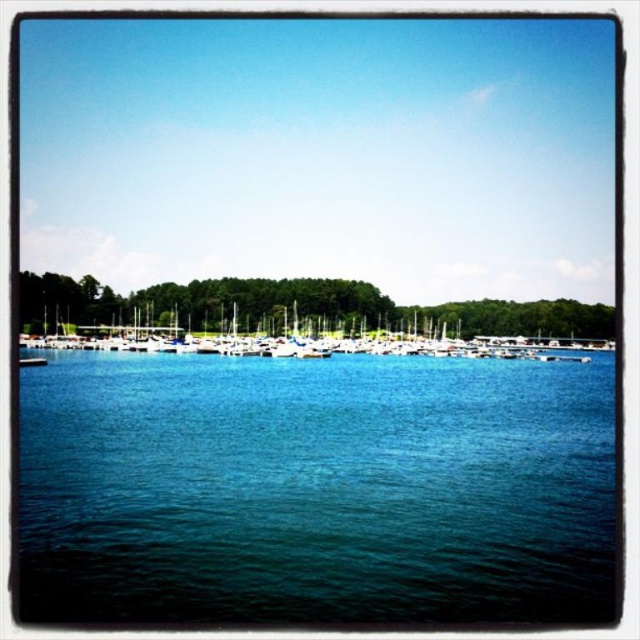
You are standing at the edge of the marina and want to take a photo that includes both the blue liquid water at center and the green leafy trees at center. Which object should you position closer to the left side of your camera frame?

The blue liquid water at center should be positioned closer to the left side of your camera frame because it is already on the left side of the green leafy trees at center.

You are a photographer planning to capture the entire marina scene. You notice the blue liquid water at center and the white matte boats at center. Which object occupies more horizontal space in the image?

The white matte boats at center occupy more horizontal space in the image than the blue liquid water at center because the blue liquid water at center has a lesser width compared to white matte boats at center.

You are a photographer standing at the edge of the marina and want to capture a photo that includes both the green leafy trees at center and the white matte boats at center. Given that your camera has a maximum focus range of 15 feet, will you be able to capture both subjects in focus without moving your position?

The distance between the green leafy trees at center and the white matte boats at center is 16.78 feet. Since your camera can only focus up to 15 feet, you won t be able to capture both subjects in focus without moving closer or adjusting your position.